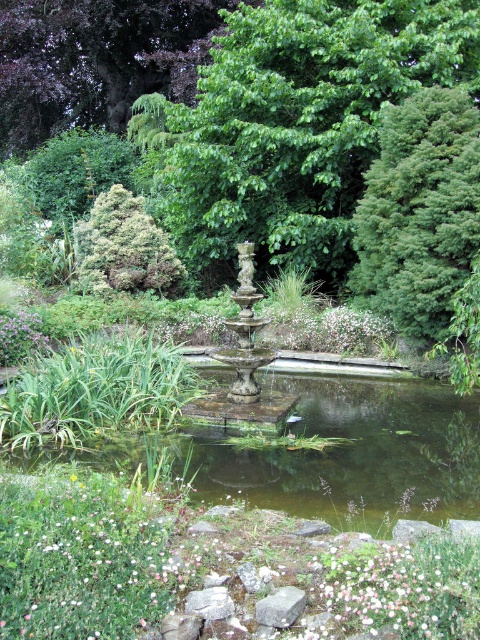
Is green leafy tree at center to the left of stone fountain at center from the viewer's perspective?

In fact, green leafy tree at center is to the right of stone fountain at center.

Does green leafy tree at center have a smaller size compared to stone fountain at center?

Correct, green leafy tree at center occupies less space than stone fountain at center.

Does point (301, 220) lie behind point (283, 412)?

Yes, it is.

You are a GUI agent. You are given a task and a screenshot of the screen. Output one action in this format:
    pyautogui.click(x=<x>, y=<y>)
    Task: Click on the green leafy tree at center
    The height and width of the screenshot is (640, 480).
    Given the screenshot: What is the action you would take?
    pyautogui.click(x=299, y=125)

Image resolution: width=480 pixels, height=640 pixels. What do you see at coordinates (87, 556) in the screenshot?
I see `white soft flower at lower left` at bounding box center [87, 556].

Measure the distance from white soft flower at lower left to purple leafy tree at upper center.

17.50 meters

What do you see at coordinates (87, 556) in the screenshot?
I see `white soft flower at lower left` at bounding box center [87, 556].

The image size is (480, 640). Find the location of `white soft flower at lower left`. white soft flower at lower left is located at coordinates (87, 556).

Is green leafy bush at upper left positioned at the back of gray rough stone at center?

Yes, green leafy bush at upper left is further from the viewer.

Which is behind, point (126, 145) or point (232, 602)?

The point (126, 145) is more distant.

Is point (59, 204) positioned after point (212, 586)?

Yes, point (59, 204) is behind point (212, 586).

Where is `green leafy bush at upper left`? This screenshot has height=640, width=480. green leafy bush at upper left is located at coordinates (76, 172).